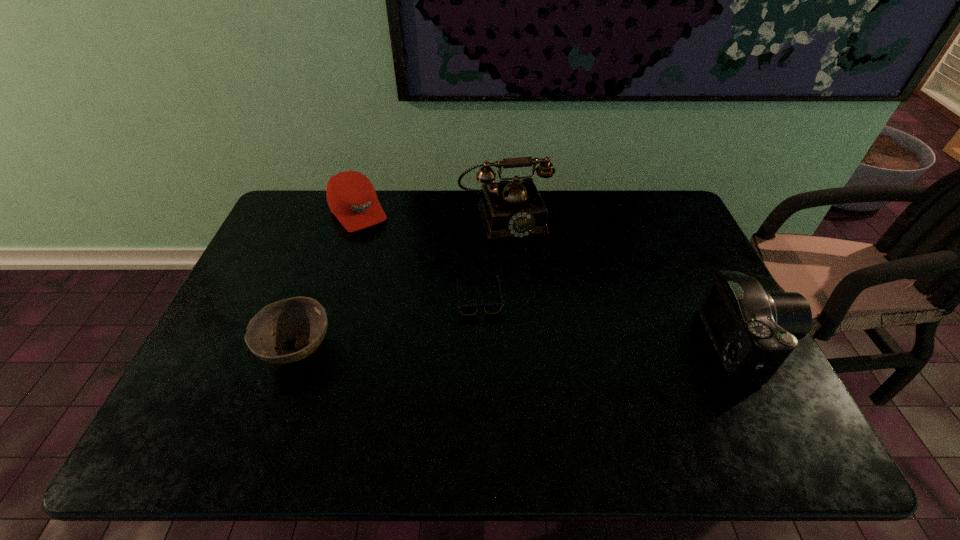
I want to click on bowl at the left edge, so click(304, 318).

You are a GUI agent. You are given a task and a screenshot of the screen. Output one action in this format:
    pyautogui.click(x=<x>, y=<y>)
    Task: Click on the cap located at the left edge
    
    Given the screenshot: What is the action you would take?
    pyautogui.click(x=351, y=197)

Locate an element on the screen. The height and width of the screenshot is (540, 960). object that is positioned at the right edge is located at coordinates (754, 331).

At what (x,y) coordinates should I click in order to perform the action: click on object that is at the far left corner. Please return your answer as a coordinate pair (x, y). The image size is (960, 540). Looking at the image, I should click on (351, 197).

The height and width of the screenshot is (540, 960). I want to click on object that is at the near left corner, so click(304, 318).

Where is `object that is at the near right corner`? This screenshot has width=960, height=540. object that is at the near right corner is located at coordinates (754, 331).

Identify the location of vacant region at the far edge of the desktop. (616, 208).

Locate an element on the screen. vacant space at the near edge of the desktop is located at coordinates (511, 379).

The image size is (960, 540). I want to click on vacant space at the left edge, so click(x=243, y=358).

At what (x,y) coordinates should I click in order to perform the action: click on free space at the right edge of the desktop. Please return your answer as a coordinate pair (x, y). The image size is (960, 540). Looking at the image, I should click on (675, 290).